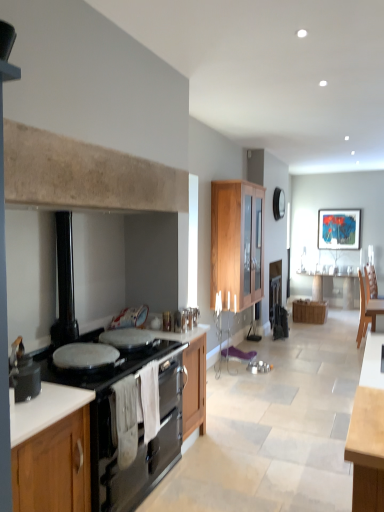
I want to click on free space to the right of matte black pot at left, so click(54, 399).